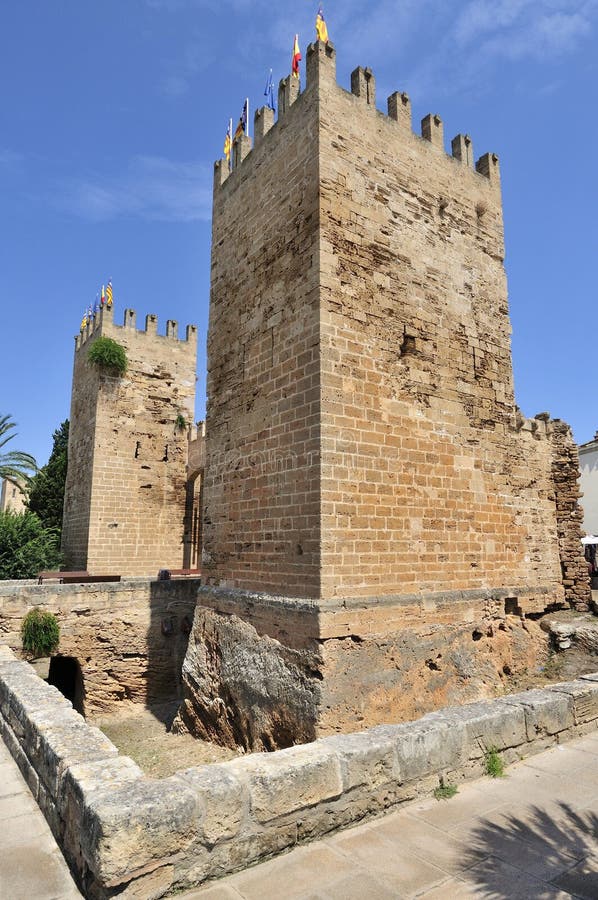
Locate an element on the screen. This screenshot has width=598, height=900. arch is located at coordinates (213, 455).